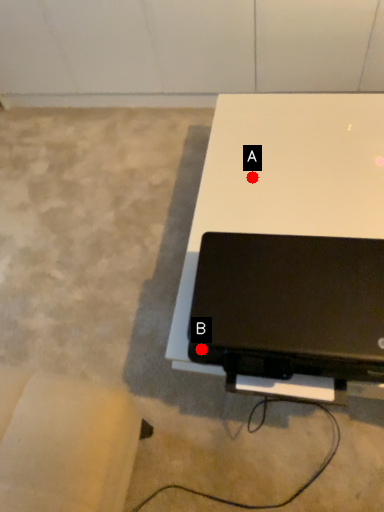
Question: Two points are circled on the image, labeled by A and B beside each circle. Which point is farther to the camera?

Choices:
 (A) A is further
 (B) B is further

Answer: (A)